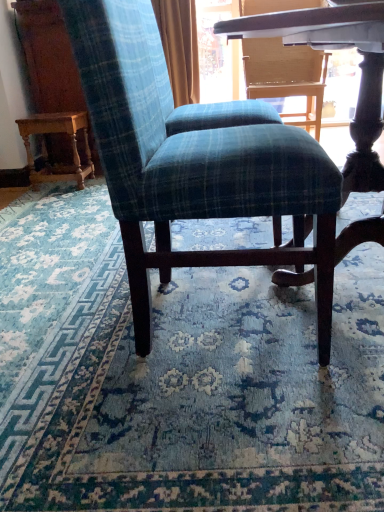
Question: Is the position of plaid fabric chair at center more distant than that of blue plaid fabric at center?

Choices:
 (A) yes
 (B) no

Answer: (B)

Question: From a real-world perspective, does plaid fabric chair at center stand above blue plaid fabric at center?

Choices:
 (A) yes
 (B) no

Answer: (A)

Question: Can you confirm if plaid fabric chair at center is bigger than blue plaid fabric at center?

Choices:
 (A) yes
 (B) no

Answer: (A)

Question: Considering the relative positions of plaid fabric chair at center and blue plaid fabric at center in the image provided, is plaid fabric chair at center to the right of blue plaid fabric at center from the viewer's perspective?

Choices:
 (A) yes
 (B) no

Answer: (A)

Question: Is plaid fabric chair at center turned away from blue plaid fabric at center?

Choices:
 (A) no
 (B) yes

Answer: (A)

Question: Considering the positions of point (157, 200) and point (56, 177), is point (157, 200) closer or farther from the camera than point (56, 177)?

Choices:
 (A) farther
 (B) closer

Answer: (B)

Question: Looking at the image, does plaid fabric chair at center seem bigger or smaller compared to wooden carved table at left?

Choices:
 (A) small
 (B) big

Answer: (B)

Question: Would you say plaid fabric chair at center is inside or outside wooden carved table at left?

Choices:
 (A) inside
 (B) outside

Answer: (B)

Question: From the image's perspective, relative to wooden carved table at left, is plaid fabric chair at center above or below?

Choices:
 (A) below
 (B) above

Answer: (A)

Question: Considering the positions of wooden carved table at left and plaid fabric chair at center in the image, is wooden carved table at left bigger or smaller than plaid fabric chair at center?

Choices:
 (A) small
 (B) big

Answer: (A)

Question: Do you think wooden carved table at left is within plaid fabric chair at center, or outside of it?

Choices:
 (A) inside
 (B) outside

Answer: (B)

Question: From the image's perspective, is wooden carved table at left located above or below plaid fabric chair at center?

Choices:
 (A) above
 (B) below

Answer: (A)

Question: From a real-world perspective, is wooden carved table at left physically located above or below plaid fabric chair at center?

Choices:
 (A) below
 (B) above

Answer: (A)

Question: Is blue plaid fabric at center bigger or smaller than wooden carved table at left?

Choices:
 (A) small
 (B) big

Answer: (B)

Question: Relative to wooden carved table at left, is blue plaid fabric at center in front or behind?

Choices:
 (A) front
 (B) behind

Answer: (A)